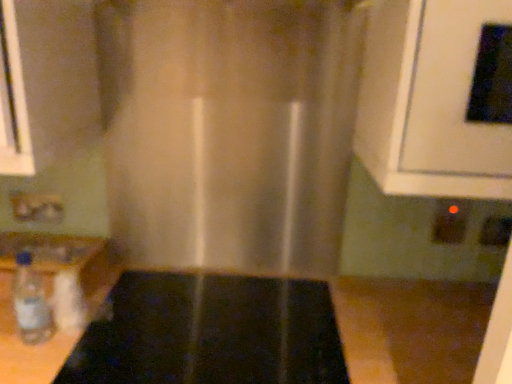
Question: Is clear plastic bottle at lower left bigger than black glossy oven at upper right?

Choices:
 (A) yes
 (B) no

Answer: (B)

Question: Is clear plastic bottle at lower left facing away from black glossy oven at upper right?

Choices:
 (A) no
 (B) yes

Answer: (A)

Question: Considering the relative sizes of clear plastic bottle at lower left and black glossy oven at upper right in the image provided, is clear plastic bottle at lower left thinner than black glossy oven at upper right?

Choices:
 (A) yes
 (B) no

Answer: (A)

Question: From a real-world perspective, is clear plastic bottle at lower left physically below black glossy oven at upper right?

Choices:
 (A) yes
 (B) no

Answer: (A)

Question: Considering the relative positions of clear plastic bottle at lower left and black glossy oven at upper right in the image provided, is clear plastic bottle at lower left to the right of black glossy oven at upper right from the viewer's perspective?

Choices:
 (A) no
 (B) yes

Answer: (A)

Question: From the image's perspective, is black glass stove at center positioned above or below black plastic electric outlet at lower right, which appears as the third electric outlet when viewed from the left?

Choices:
 (A) above
 (B) below

Answer: (B)

Question: Based on their sizes in the image, would you say black glass stove at center is bigger or smaller than black plastic electric outlet at lower right, the 1th electric outlet in the right-to-left sequence?

Choices:
 (A) big
 (B) small

Answer: (A)

Question: Considering their positions, is black glass stove at center located in front of or behind black plastic electric outlet at lower right, the 1th electric outlet in the right-to-left sequence?

Choices:
 (A) front
 (B) behind

Answer: (A)

Question: From a real-world perspective, relative to black plastic electric outlet at lower right, which appears as the third electric outlet when viewed from the left, is black glass stove at center vertically above or below?

Choices:
 (A) above
 (B) below

Answer: (B)

Question: Is point (441, 1) positioned closer to the camera than point (33, 213)?

Choices:
 (A) closer
 (B) farther

Answer: (A)

Question: From a real-world perspective, is black glossy oven at upper right above or below matte plastic electric outlet at lower left, the first electric outlet from the left?

Choices:
 (A) below
 (B) above

Answer: (B)

Question: Is black glossy oven at upper right in front of or behind matte plastic electric outlet at lower left, which is the third electric outlet in right-to-left order, in the image?

Choices:
 (A) front
 (B) behind

Answer: (A)

Question: From the image's perspective, relative to matte plastic electric outlet at lower left, which is the third electric outlet in right-to-left order, is black glossy oven at upper right above or below?

Choices:
 (A) below
 (B) above

Answer: (B)

Question: From the image's perspective, is black plastic electric outlet at lower right, which is the 2th electric outlet from right to left, positioned above or below black glossy oven at upper right?

Choices:
 (A) below
 (B) above

Answer: (A)

Question: Is black plastic electric outlet at lower right, which is the 2th electric outlet from right to left, wider or thinner than black glossy oven at upper right?

Choices:
 (A) wide
 (B) thin

Answer: (B)